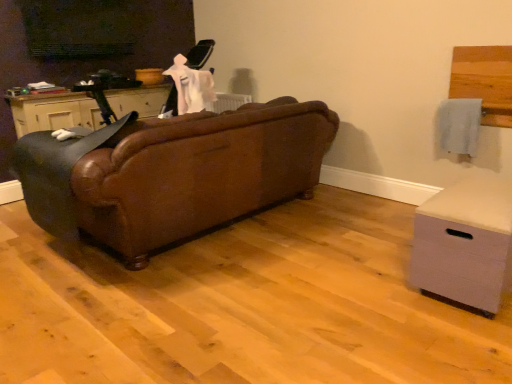
Find the location of a particular element. This screenshot has width=512, height=384. matte black cabinet at left is located at coordinates (54, 112).

Based on the photo, does light gray fabric chest of drawers at lower right have a greater width compared to brown leather couch at center?

In fact, light gray fabric chest of drawers at lower right might be narrower than brown leather couch at center.

Does light gray fabric chest of drawers at lower right appear on the right side of brown leather couch at center?

Indeed, light gray fabric chest of drawers at lower right is positioned on the right side of brown leather couch at center.

Is light gray fabric chest of drawers at lower right not inside brown leather couch at center?

Yes, light gray fabric chest of drawers at lower right is outside of brown leather couch at center.

Find the location of a particular element. studio couch on the left of the light gray fabric chest of drawers at lower right is located at coordinates (173, 173).

From the image's perspective, which is above, brown leather rocking chair at left or matte black cabinet at left?

matte black cabinet at left appears higher in the image.

Is brown leather rocking chair at left bigger or smaller than matte black cabinet at left?

Considering their sizes, brown leather rocking chair at left takes up more space than matte black cabinet at left.

Based on the photo, does brown leather rocking chair at left come in front of matte black cabinet at left?

Yes, it is in front of matte black cabinet at left.

From a real-world perspective, which is physically above, brown leather rocking chair at left or matte black cabinet at left?

From a 3D spatial view, matte black cabinet at left is above.

Is brown leather rocking chair at left oriented away from brown leather couch at center?

Yes, brown leather rocking chair at left is facing away from brown leather couch at center.

Which is closer, (76, 223) or (313, 136)?

Point (76, 223) appears to be closer to the viewer than point (313, 136).

Considering the sizes of objects brown leather rocking chair at left and brown leather couch at center in the image provided, who is smaller, brown leather rocking chair at left or brown leather couch at center?

brown leather rocking chair at left is smaller.

The image size is (512, 384). In the image, there is a brown leather rocking chair at left. What are the coordinates of `studio couch below it (from a real-world perspective)` in the screenshot? It's located at coord(173,173).

Is brown leather couch at center oriented towards brown leather rocking chair at left?

Yes, brown leather couch at center is facing brown leather rocking chair at left.

From the image's perspective, who appears lower, brown leather couch at center or brown leather rocking chair at left?

brown leather rocking chair at left appears lower in the image.

Are brown leather couch at center and matte black cabinet at left making contact?

No, brown leather couch at center is not beside matte black cabinet at left.

Does point (202, 184) come behind point (166, 92)?

No, (202, 184) is closer to viewer.

Between brown leather couch at center and matte black cabinet at left, which one has less height?

Standing shorter between the two is matte black cabinet at left.

Which is behind, brown leather couch at center or matte black cabinet at left?

Positioned behind is matte black cabinet at left.

This screenshot has width=512, height=384. What are the coordinates of `chest of drawers located on the right of brown leather couch at center` in the screenshot? It's located at (465, 243).

Is point (314, 142) positioned behind point (489, 310)?

Yes.

Considering the positions of objects brown leather couch at center and light gray fabric chest of drawers at lower right in the image provided, who is more to the left, brown leather couch at center or light gray fabric chest of drawers at lower right?

From the viewer's perspective, brown leather couch at center appears more on the left side.

Does brown leather couch at center have a greater width compared to light gray fabric chest of drawers at lower right?

Correct, the width of brown leather couch at center exceeds that of light gray fabric chest of drawers at lower right.

Looking at this image, how different are the orientations of matte black cabinet at left and light gray fabric chest of drawers at lower right in degrees?

The facing directions of matte black cabinet at left and light gray fabric chest of drawers at lower right are 86.6 degrees apart.

Considering the relative sizes of matte black cabinet at left and light gray fabric chest of drawers at lower right in the image provided, is matte black cabinet at left wider than light gray fabric chest of drawers at lower right?

No, matte black cabinet at left is not wider than light gray fabric chest of drawers at lower right.

From the picture: Considering the relative positions of matte black cabinet at left and light gray fabric chest of drawers at lower right in the image provided, is matte black cabinet at left to the left or to the right of light gray fabric chest of drawers at lower right?

From the image, it's evident that matte black cabinet at left is to the left of light gray fabric chest of drawers at lower right.

Considering the relative sizes of matte black cabinet at left and light gray fabric chest of drawers at lower right in the image provided, is matte black cabinet at left bigger than light gray fabric chest of drawers at lower right?

Correct, matte black cabinet at left is larger in size than light gray fabric chest of drawers at lower right.

Where is `studio couch above the light gray fabric chest of drawers at lower right (from a real-world perspective)`? The image size is (512, 384). studio couch above the light gray fabric chest of drawers at lower right (from a real-world perspective) is located at coordinates (173, 173).

In order to click on rocking chair that is on the right side of matte black cabinet at left in this screenshot , I will do `click(56, 174)`.

Based on their spatial positions, is matte black cabinet at left or light gray fabric chest of drawers at lower right closer to brown leather couch at center?

matte black cabinet at left is closer to brown leather couch at center.

Estimate the real-world distances between objects in this image. Which object is further from matte black cabinet at left, brown leather rocking chair at left or light gray fabric chest of drawers at lower right?

light gray fabric chest of drawers at lower right lies further to matte black cabinet at left than the other object.

Considering their positions, is light gray fabric chest of drawers at lower right positioned closer to matte black cabinet at left than brown leather couch at center?

brown leather couch at center is closer to matte black cabinet at left.

Based on their spatial positions, is brown leather rocking chair at left or matte black cabinet at left further from light gray fabric chest of drawers at lower right?

matte black cabinet at left lies further to light gray fabric chest of drawers at lower right than the other object.

Estimate the real-world distances between objects in this image. Which object is closer to light gray fabric chest of drawers at lower right, brown leather couch at center or brown leather rocking chair at left?

brown leather couch at center.

When comparing their distances from matte black cabinet at left, does brown leather rocking chair at left or brown leather couch at center seem closer?

brown leather rocking chair at left lies closer to matte black cabinet at left than the other object.

Looking at the image, which one is located further to brown leather rocking chair at left, matte black cabinet at left or light gray fabric chest of drawers at lower right?

light gray fabric chest of drawers at lower right lies further to brown leather rocking chair at left than the other object.

Estimate the real-world distances between objects in this image. Which object is closer to brown leather couch at center, matte black cabinet at left or brown leather rocking chair at left?

brown leather rocking chair at left.

Identify the location of studio couch between matte black cabinet at left and light gray fabric chest of drawers at lower right in the horizontal direction. The width and height of the screenshot is (512, 384). (173, 173).

Locate an element on the screen. studio couch between brown leather rocking chair at left and light gray fabric chest of drawers at lower right is located at coordinates (173, 173).

Where is `rocking chair positioned between brown leather couch at center and matte black cabinet at left from near to far`? Image resolution: width=512 pixels, height=384 pixels. rocking chair positioned between brown leather couch at center and matte black cabinet at left from near to far is located at coordinates (56, 174).

Find the location of `rocking chair between matte black cabinet at left and light gray fabric chest of drawers at lower right from left to right`. rocking chair between matte black cabinet at left and light gray fabric chest of drawers at lower right from left to right is located at coordinates (56, 174).